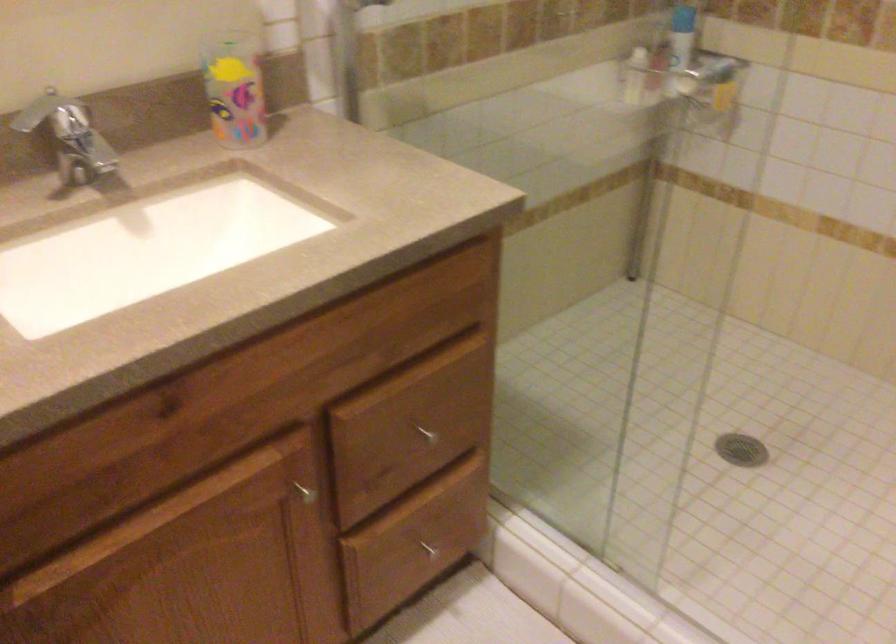
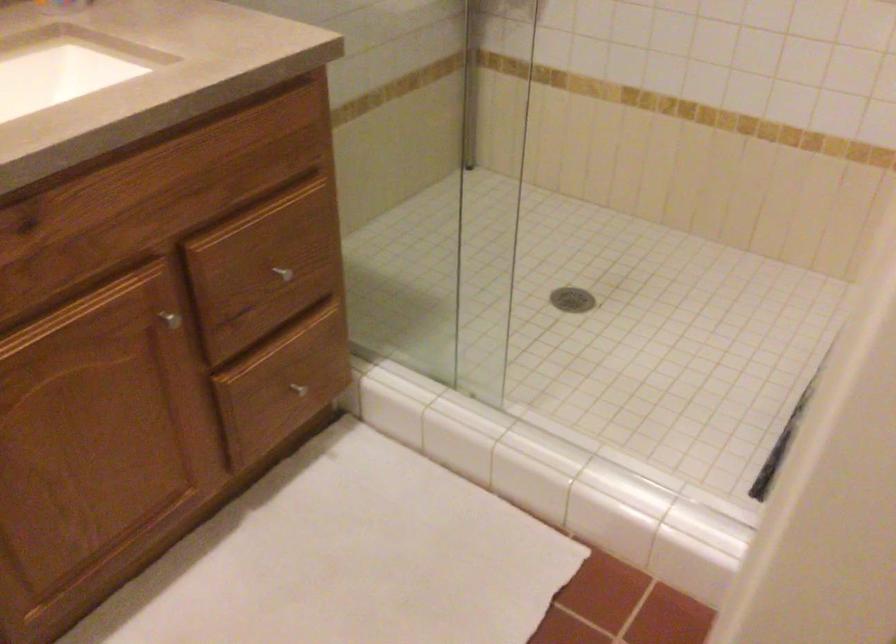
Where in the second image is the point corresponding to pixel 426 436 from the first image?

(281, 272)